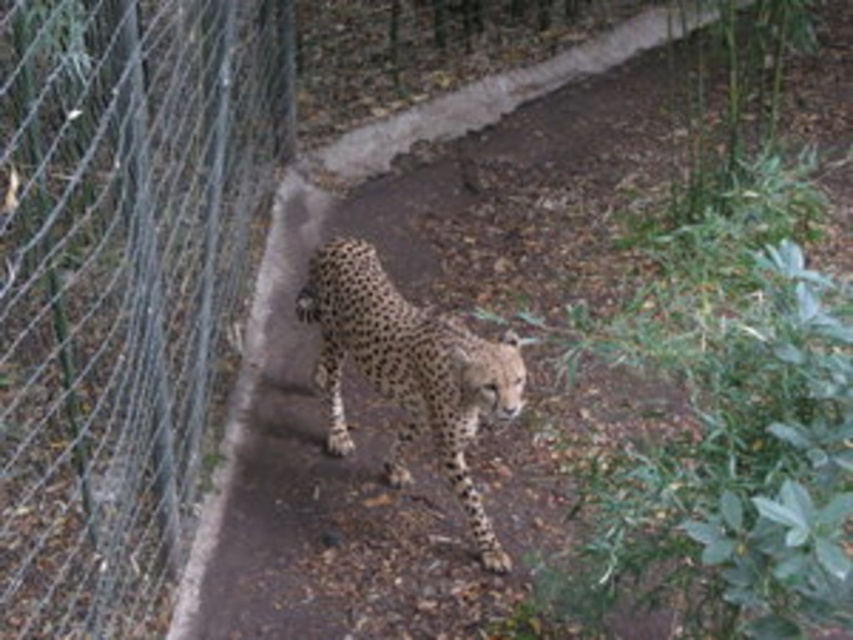
Question: Can you confirm if wire mesh fence at left is wider than spotted fur cheetah at center?

Choices:
 (A) yes
 (B) no

Answer: (A)

Question: Can you confirm if wire mesh fence at left is positioned to the right of spotted fur cheetah at center?

Choices:
 (A) yes
 (B) no

Answer: (B)

Question: In this image, where is spotted fur cheetah at center located relative to brown dirt path at center?

Choices:
 (A) right
 (B) left

Answer: (B)

Question: Which point is closer to the camera?

Choices:
 (A) (136, 476)
 (B) (397, 476)

Answer: (A)

Question: Which of the following is the farthest from the observer?

Choices:
 (A) brown dirt path at center
 (B) wire mesh fence at left

Answer: (A)

Question: Which point appears farthest from the camera in this image?

Choices:
 (A) (335, 257)
 (B) (210, 129)

Answer: (B)